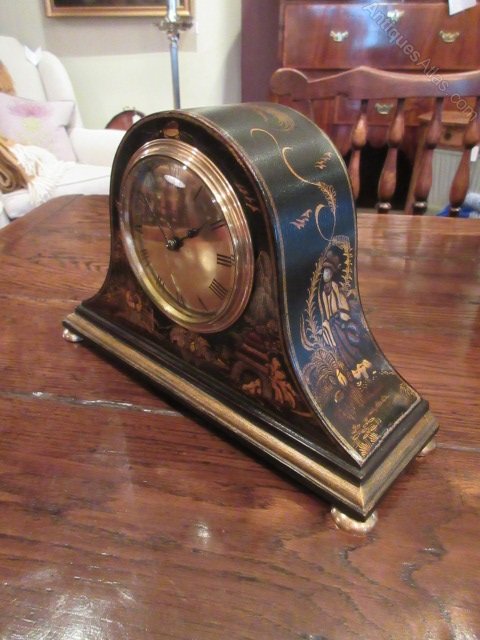
The image size is (480, 640). I want to click on bars on the back of chair, so click(x=361, y=125), click(x=398, y=130), click(x=436, y=130), click(x=470, y=141).